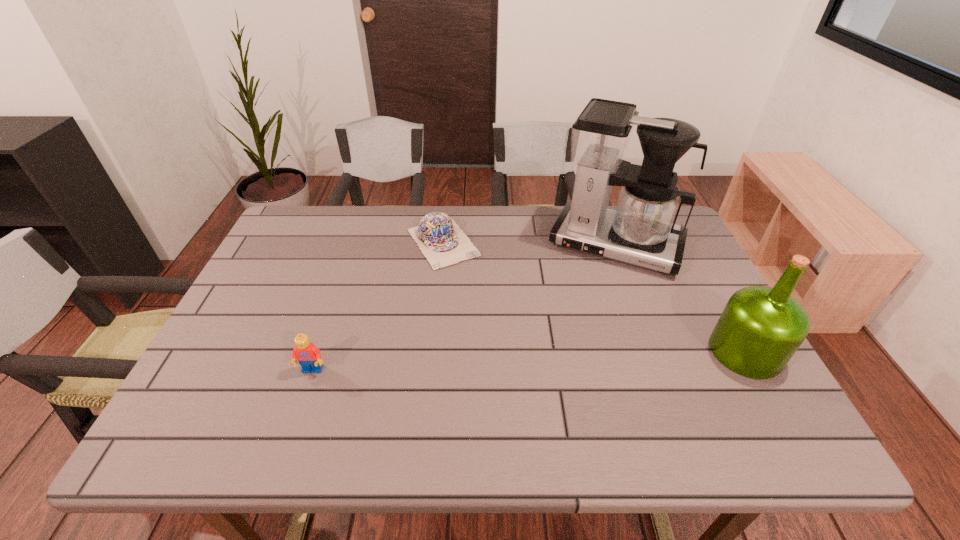
Where is `empty location between the leftmost object and the olive oil`? Image resolution: width=960 pixels, height=540 pixels. empty location between the leftmost object and the olive oil is located at coordinates [529, 361].

The height and width of the screenshot is (540, 960). What are the coordinates of `free area in between the leftmost object and the shortest object` in the screenshot? It's located at (377, 307).

In order to click on free area in between the Lego and the tallest object in this screenshot , I will do `click(464, 307)`.

This screenshot has height=540, width=960. What are the coordinates of `vacant point located between the second tallest object and the tallest object` in the screenshot? It's located at [681, 298].

The width and height of the screenshot is (960, 540). In order to click on empty space that is in between the second object from left to right and the olive oil in this screenshot , I will do `click(594, 297)`.

I want to click on unoccupied area between the leftmost object and the shortest object, so click(377, 307).

Where is `the second closest object to the cap`? Image resolution: width=960 pixels, height=540 pixels. the second closest object to the cap is located at coordinates (308, 355).

Locate which object ranks second in proximity to the shortest object. Please provide its 2D coordinates. Your answer should be formatted as a tuple, i.e. [(x, y)], where the tuple contains the x and y coordinates of a point satisfying the conditions above.

[(308, 355)]

Locate an element on the screen. The image size is (960, 540). vacant space that satisfies the following two spatial constraints: 1. on the front side of the coffee maker; 2. on the right side of the shortest object is located at coordinates (443, 245).